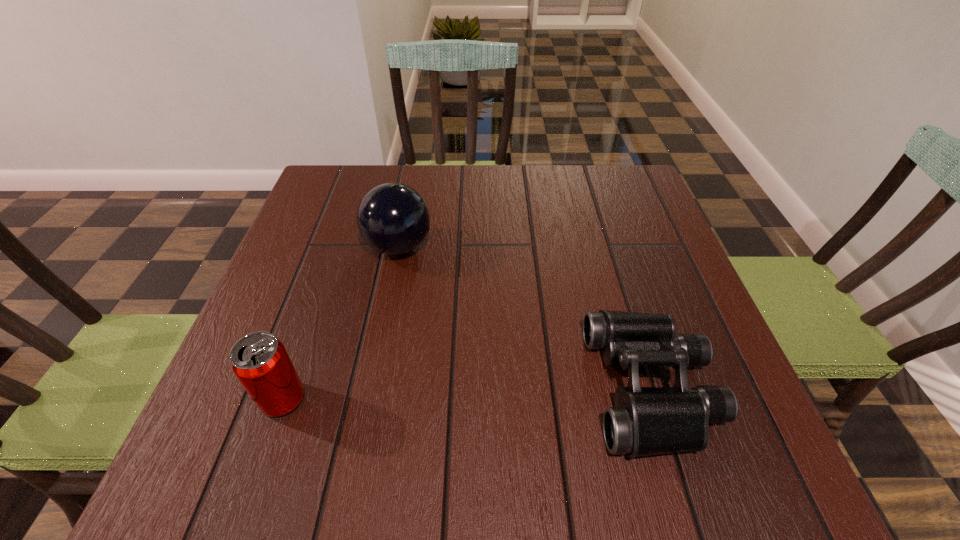
Identify the location of the second object from left to right. (392, 218).

You are a GUI agent. You are given a task and a screenshot of the screen. Output one action in this format:
    pyautogui.click(x=<x>, y=<y>)
    Task: Click on the farthest object
    The height and width of the screenshot is (540, 960).
    Given the screenshot: What is the action you would take?
    pyautogui.click(x=392, y=218)

Identify the location of soda can. Image resolution: width=960 pixels, height=540 pixels. (259, 360).

This screenshot has height=540, width=960. In order to click on the rightmost object in this screenshot , I will do `click(645, 421)`.

Identify the location of the shortest object. (645, 421).

This screenshot has height=540, width=960. Identify the location of free space located on the side of the farthest object with the finger holes. (563, 247).

This screenshot has width=960, height=540. Find the location of `vacant area located 0.150m on the back of the leftmost object`. vacant area located 0.150m on the back of the leftmost object is located at coordinates (313, 314).

Where is `vacant area situated on the front-facing side of the binoculars`? vacant area situated on the front-facing side of the binoculars is located at coordinates (535, 387).

This screenshot has height=540, width=960. Find the location of `vacant space located on the front-facing side of the binoculars`. vacant space located on the front-facing side of the binoculars is located at coordinates (372, 387).

Find the location of `vacant space located 0.200m on the front-facing side of the binoculars`. vacant space located 0.200m on the front-facing side of the binoculars is located at coordinates (477, 387).